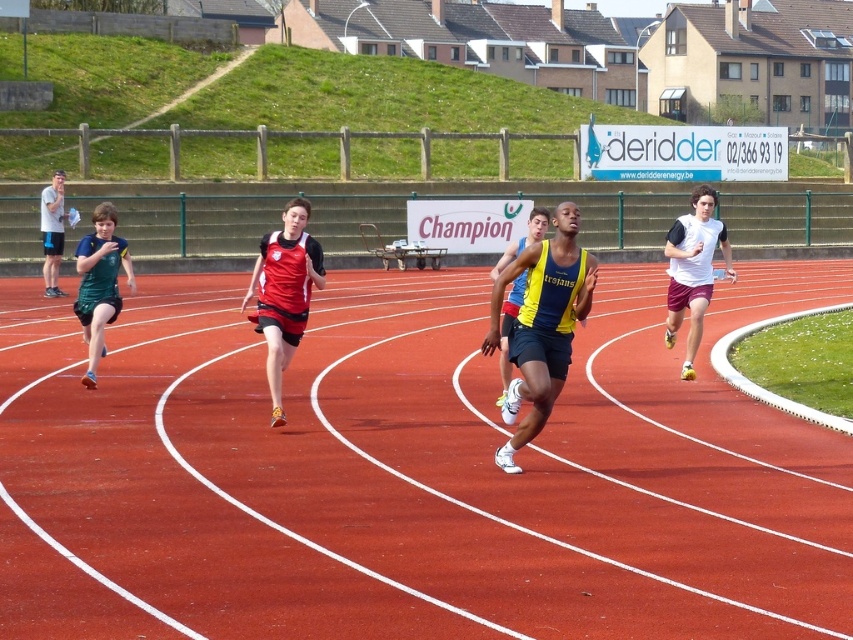
You are a photographer standing at the starting line of the track. You want to take a photo that includes both the point at coordinate (511, 248) and the point at coordinate (53, 192). Since the camera has a limited depth of field, which point should you focus on to ensure both points are in focus?

You should focus on the point at coordinate (511, 248) because it is closer to the camera than the point at coordinate (53, 192). By focusing on the closer point, the farther point may still be within the depth of field range, ensuring both are in focus.

You are an athlete standing on the red rubber track at center and looking towards the matte gray shirt at left. Which object is closer to you?

The red rubber track at center is closer to you than the matte gray shirt at left.